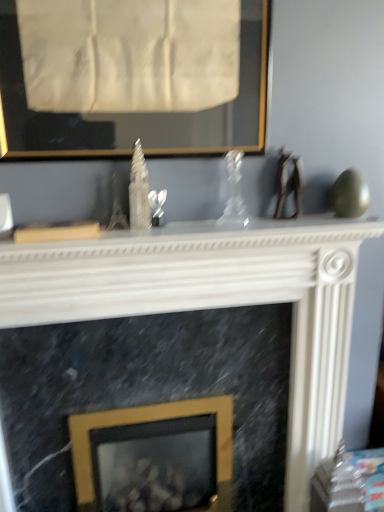
What are the coordinates of `vacant area located to the right-hand side of transparent glass vase at center` in the screenshot? It's located at (289, 226).